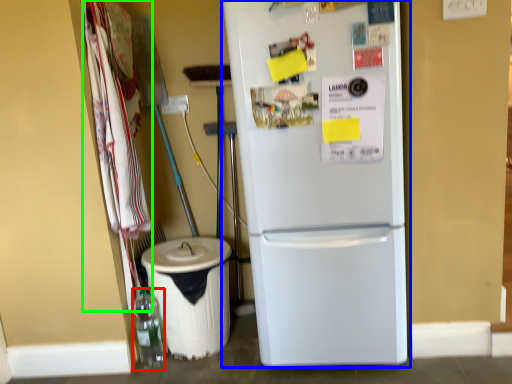
Question: Based on their relative distances, which object is farther from bottle (highlighted by a red box)? Choose from refrigerator (highlighted by a blue box) and laundry (highlighted by a green box).

Choices:
 (A) refrigerator
 (B) laundry

Answer: (A)